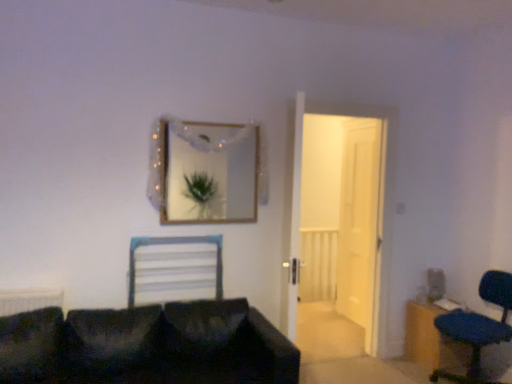
In order to click on vacant area that lies in front of wooden dresser at lower right in this screenshot , I will do `click(452, 376)`.